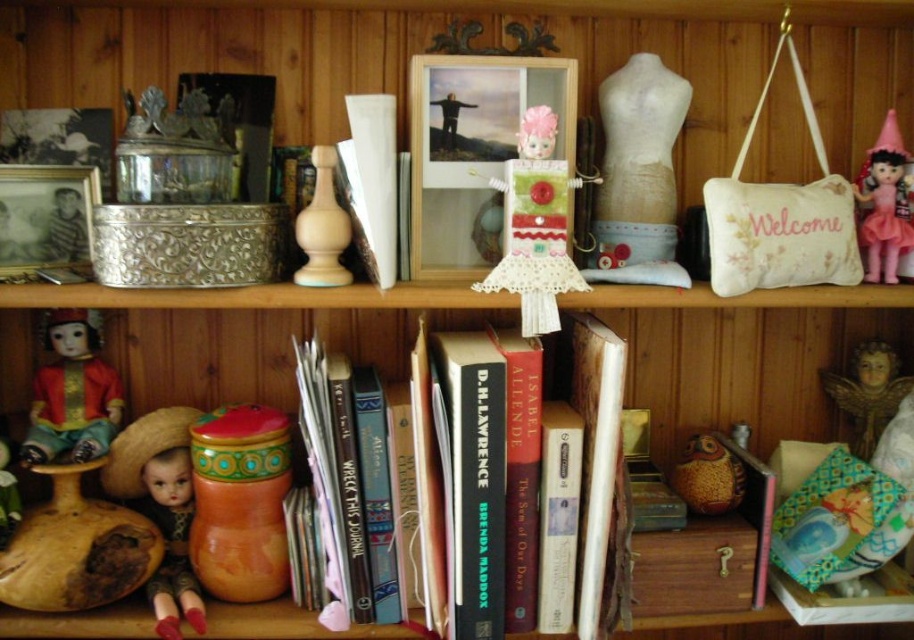
You are organizing a small shelf and need to place a new item between the hardcover book at center and the pink fabric doll at upper right. Based on their sizes, which object should you place the new item closer to?

The hardcover book at center is taller than the pink fabric doll at upper right, so the new item should be placed closer to the pink fabric doll at upper right to maintain balance.